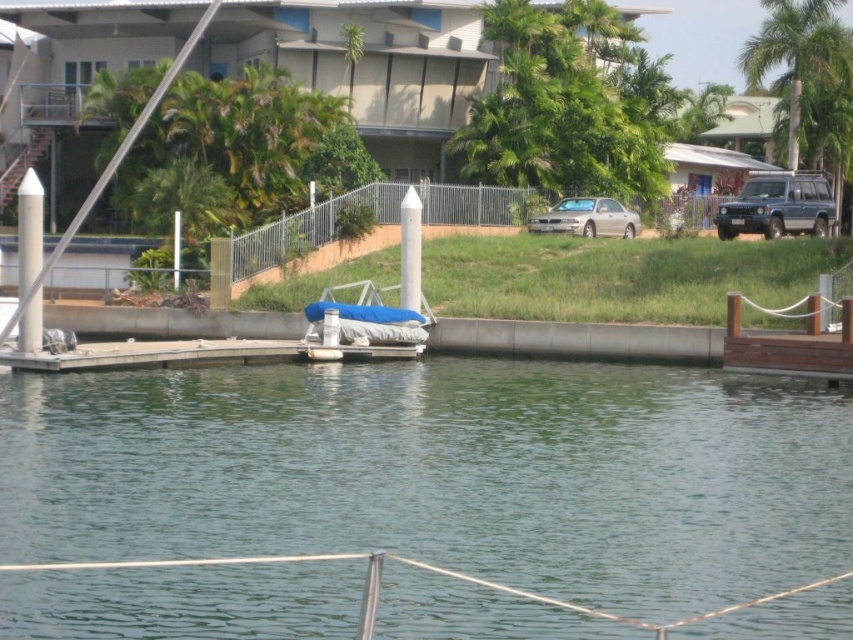
Looking at the waterfront scene, where is the green leafy palm tree at upper right located in relation to the blue fabric boat at center?

The green leafy palm tree at upper right is located to the right of the blue fabric boat at center.

Consider the image. You are standing at the edge of the waterfront scene and want to determine which of the two points, point (769, 467) or point (757, 230), is nearer to you. Based on the image, which point is closer?

Point (769, 467) is closer to the camera than point (757, 230), so it is the nearer point.